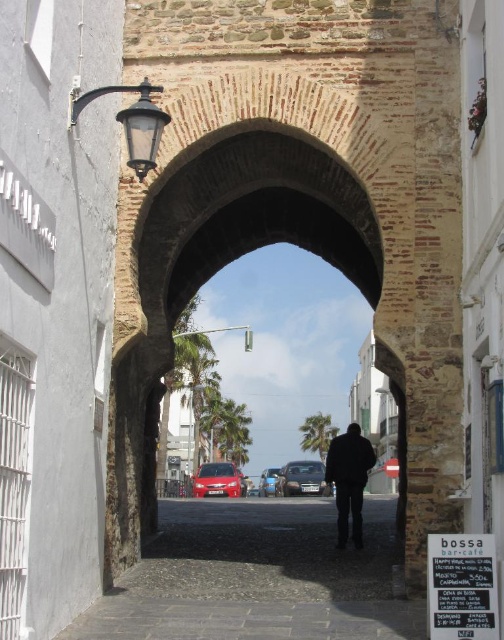
You are a delivery driver trying to navigate through the narrow street scene. You see the dark gray cobblestone alley at center and the metallic silver car at center. Which object is blocking your path?

The dark gray cobblestone alley at center is positioned over the metallic silver car at center, so the alley is blocking the path of the metallic silver car at center.

You are standing at the entrance of the street and see the point marked at coordinates (217, 481). What object is located at that point?

The point at coordinates (217, 481) corresponds to the shiny red car at center.

You are standing at the entrance of the arched stone gateway and want to park your shiny red car at center. Based on the scene, can you determine if the car is positioned in the middle of the street or closer to one side?

The shiny red car at center is located at point coordinates that are not directly indicating its position relative to the street sides. However, since the car is labeled as being at the center, it is positioned in the middle of the street.